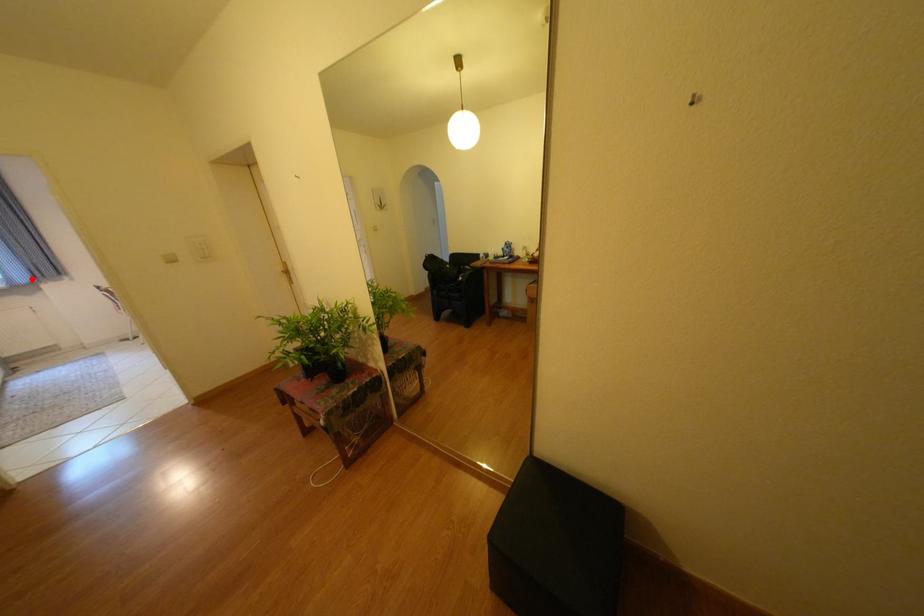
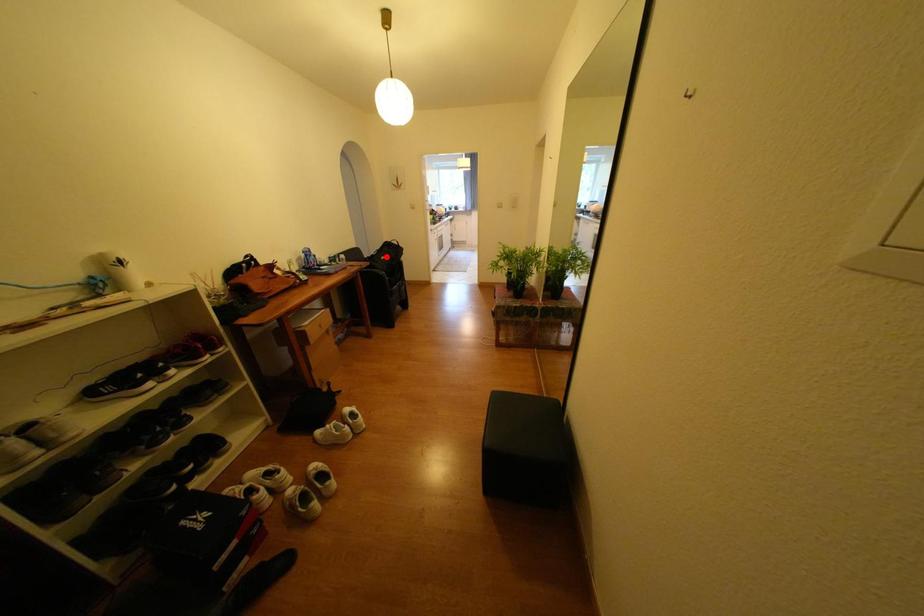
I am providing you with two images of the same scene from different viewpoints. A red point is marked on the first image and another point is marked on the second image. Are the points marked in image1 and image2 representing the same 3D position?

No